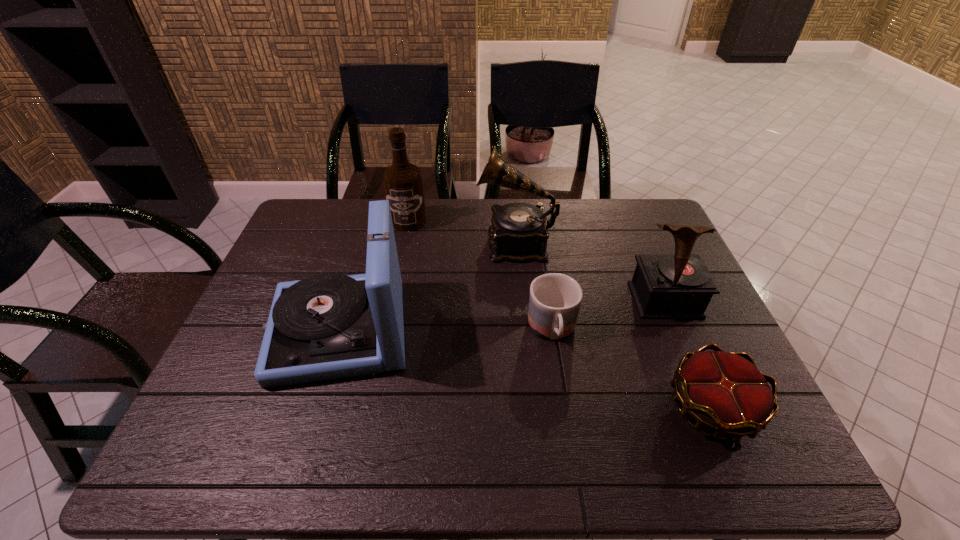
You are a GUI agent. You are given a task and a screenshot of the screen. Output one action in this format:
    pyautogui.click(x=<x>, y=<y>)
    Task: Click on the vacant space that satisfies the following two spatial constraints: 1. on the side with the handle of the mug; 2. on the right side of the crown
    The height and width of the screenshot is (540, 960).
    Given the screenshot: What is the action you would take?
    pyautogui.click(x=564, y=407)

Find the location of `vacant space that satisfies the following two spatial constraints: 1. on the horn of the farthest phonograph_record; 2. on the front side of the leftmost phonograph_record`. vacant space that satisfies the following two spatial constraints: 1. on the horn of the farthest phonograph_record; 2. on the front side of the leftmost phonograph_record is located at coordinates (523, 330).

Locate an element on the screen. blank space that satisfies the following two spatial constraints: 1. at the horn opening of the rightmost phonograph_record; 2. on the right side of the crown is located at coordinates (710, 407).